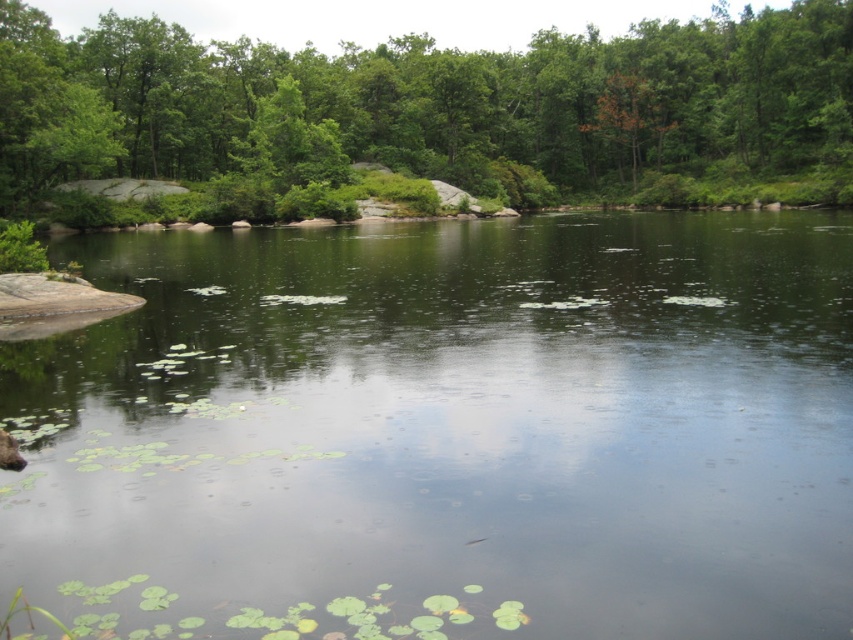
Question: Can you confirm if green leafy tree at center is wider than brown furry animal at lower left?

Choices:
 (A) yes
 (B) no

Answer: (A)

Question: Which object appears farthest from the camera in this image?

Choices:
 (A) green leafy tree at center
 (B) orange-brown wood tree at upper center
 (C) green smooth water at center

Answer: (B)

Question: Considering the real-world distances, which object is farthest from the green smooth water at center?

Choices:
 (A) brown furry animal at lower left
 (B) orange-brown wood tree at upper center
 (C) green leafy tree at center

Answer: (B)

Question: Does green smooth water at center lie behind brown furry animal at lower left?

Choices:
 (A) no
 (B) yes

Answer: (A)

Question: Which object is positioned closest to the orange-brown wood tree at upper center?

Choices:
 (A) green smooth water at center
 (B) green leafy tree at center
 (C) brown furry animal at lower left

Answer: (B)

Question: Considering the relative positions of green smooth water at center and orange-brown wood tree at upper center in the image provided, where is green smooth water at center located with respect to orange-brown wood tree at upper center?

Choices:
 (A) left
 (B) right

Answer: (A)